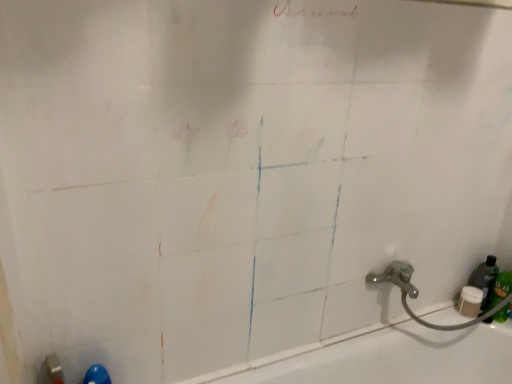
You are a GUI agent. You are given a task and a screenshot of the screen. Output one action in this format:
    pyautogui.click(x=<x>, y=<y>)
    Task: Click on the white glossy bathtub at lower right
    
    Given the screenshot: What is the action you would take?
    coord(398,358)

The width and height of the screenshot is (512, 384). What do you see at coordinates (398, 358) in the screenshot? I see `white glossy bathtub at lower right` at bounding box center [398, 358].

Find the location of a particular element. The height and width of the screenshot is (384, 512). green matte bottle at lower right is located at coordinates (485, 280).

The width and height of the screenshot is (512, 384). What do you see at coordinates (485, 280) in the screenshot?
I see `green matte bottle at lower right` at bounding box center [485, 280].

Find the location of a particular element. The height and width of the screenshot is (384, 512). white glossy bathtub at lower right is located at coordinates (398, 358).

Which object is positioned more to the right, green matte bottle at lower right or white glossy bathtub at lower right?

→ From the viewer's perspective, green matte bottle at lower right appears more on the right side.

Is green matte bottle at lower right positioned before white glossy bathtub at lower right?

No, green matte bottle at lower right is further to the viewer.

Is point (489, 276) closer to camera compared to point (485, 342)?

No, (489, 276) is behind (485, 342).

From the image's perspective, which object appears higher, green matte bottle at lower right or white glossy bathtub at lower right?

From the image's view, green matte bottle at lower right is above.

From a real-world perspective, is green matte bottle at lower right on top of white glossy bathtub at lower right?

Yes, from a real-world perspective, green matte bottle at lower right is on top of white glossy bathtub at lower right.

Which object is thinner, green matte bottle at lower right or white glossy bathtub at lower right?

With smaller width is green matte bottle at lower right.

In terms of height, does green matte bottle at lower right look taller or shorter compared to white glossy bathtub at lower right?

green matte bottle at lower right is shorter than white glossy bathtub at lower right.

Can you confirm if green matte bottle at lower right is bigger than white glossy bathtub at lower right?

Incorrect, green matte bottle at lower right is not larger than white glossy bathtub at lower right.

Can we say green matte bottle at lower right lies outside white glossy bathtub at lower right?

Absolutely, green matte bottle at lower right is external to white glossy bathtub at lower right.

Is green matte bottle at lower right far away from white glossy bathtub at lower right?

green matte bottle at lower right is actually quite close to white glossy bathtub at lower right.

Does green matte bottle at lower right turn towards white glossy bathtub at lower right?

No, green matte bottle at lower right is not oriented towards white glossy bathtub at lower right.

How different are the orientations of green matte bottle at lower right and white glossy bathtub at lower right in degrees?

There is a 4.86-degree angle between the facing directions of green matte bottle at lower right and white glossy bathtub at lower right.

Find the location of `bath located in front of the green matte bottle at lower right`. bath located in front of the green matte bottle at lower right is located at coordinates (398, 358).

Does white glossy bathtub at lower right appear on the left side of green matte bottle at lower right?

Correct, you'll find white glossy bathtub at lower right to the left of green matte bottle at lower right.

Which object is closer to the camera, white glossy bathtub at lower right or green matte bottle at lower right?

white glossy bathtub at lower right is closer to the camera.

Considering the positions of point (487, 355) and point (483, 268), is point (487, 355) closer or farther from the camera than point (483, 268)?

Clearly, point (487, 355) is closer to the camera than point (483, 268).

From the image's perspective, between white glossy bathtub at lower right and green matte bottle at lower right, which one is located above?

green matte bottle at lower right, from the image's perspective.

From a real-world perspective, is white glossy bathtub at lower right physically above green matte bottle at lower right?

No.

Is white glossy bathtub at lower right thinner than green matte bottle at lower right?

No.

Which of these two, white glossy bathtub at lower right or green matte bottle at lower right, stands shorter?

green matte bottle at lower right.

Which of these two, white glossy bathtub at lower right or green matte bottle at lower right, is smaller?

green matte bottle at lower right is smaller.

Would you say green matte bottle at lower right is part of white glossy bathtub at lower right's contents?

No, green matte bottle at lower right is not surrounded by white glossy bathtub at lower right.

Is white glossy bathtub at lower right positioned far away from green matte bottle at lower right?

They are positioned close to each other.

Could you tell me if white glossy bathtub at lower right is turned towards green matte bottle at lower right?

No, white glossy bathtub at lower right is not turned towards green matte bottle at lower right.

How different are the orientations of white glossy bathtub at lower right and green matte bottle at lower right in degrees?

The angular difference between white glossy bathtub at lower right and green matte bottle at lower right is 4.86 degrees.

Locate an element on the screen. Image resolution: width=512 pixels, height=384 pixels. bottle behind the white glossy bathtub at lower right is located at coordinates (485, 280).

This screenshot has width=512, height=384. I want to click on bottle above the white glossy bathtub at lower right (from the image's perspective), so click(x=485, y=280).

I want to click on bath to the left of green matte bottle at lower right, so click(x=398, y=358).